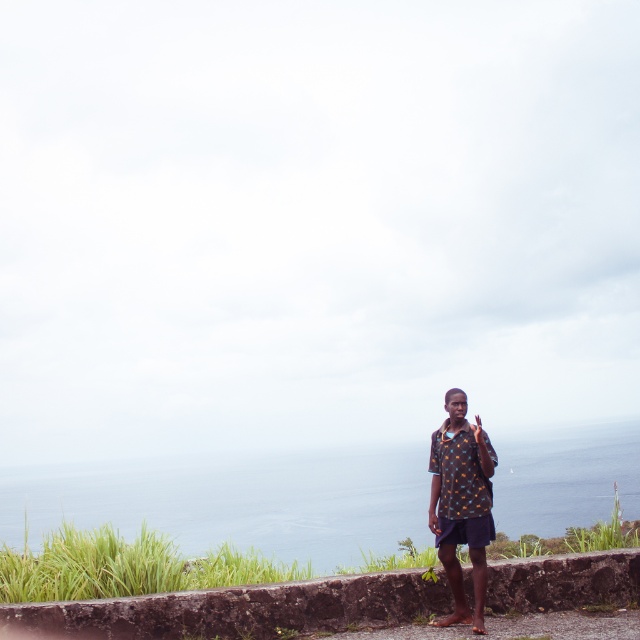
You are standing on the rustic stone ledge at lower right and want to look at the blue water at center. In which direction should you look?

The blue water at center is positioned under the rustic stone ledge at lower right, so you should look downward to see it.

You are standing at the coastal scene and want to place a small seashell on the rustic stone ledge at lower right. To ensure it doesn not fall off, where should you position the seashell relative to the printed fabric shirt at center?

You should position the seashell on the side of the rustic stone ledge at lower right that is closer to the printed fabric shirt at center, since the rustic stone ledge at lower right is to the left of the printed fabric shirt at center, placing it towards the shirt would keep it stable.

You are standing on the paved area bordered by the low stone wall and want to place a small potted plant on the rustic stone ledge at lower right. However, you notice the printed fabric shirt at center is in the way. Can you place the plant on the ledge without moving the shirt?

The rustic stone ledge at lower right is positioned under the printed fabric shirt at center, so the shirt is blocking access to the ledge. You would need to move the shirt or find another location to place the plant.